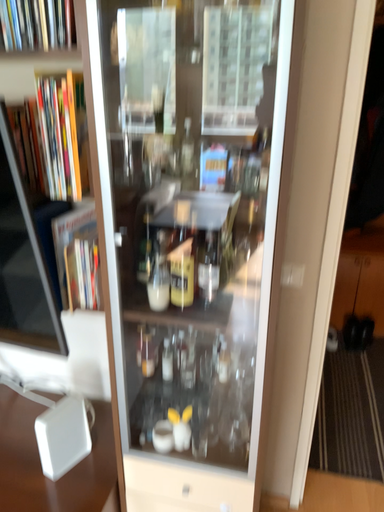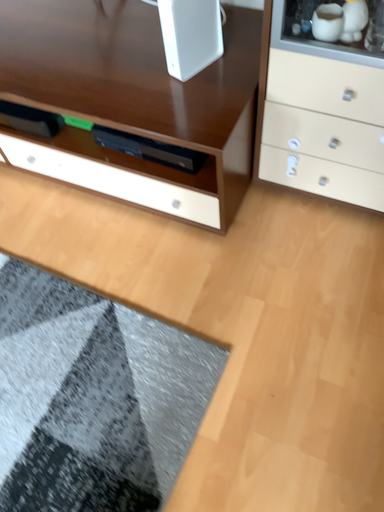
Question: Which way did the camera rotate in the video?

Choices:
 (A) rotated right
 (B) rotated left

Answer: (B)